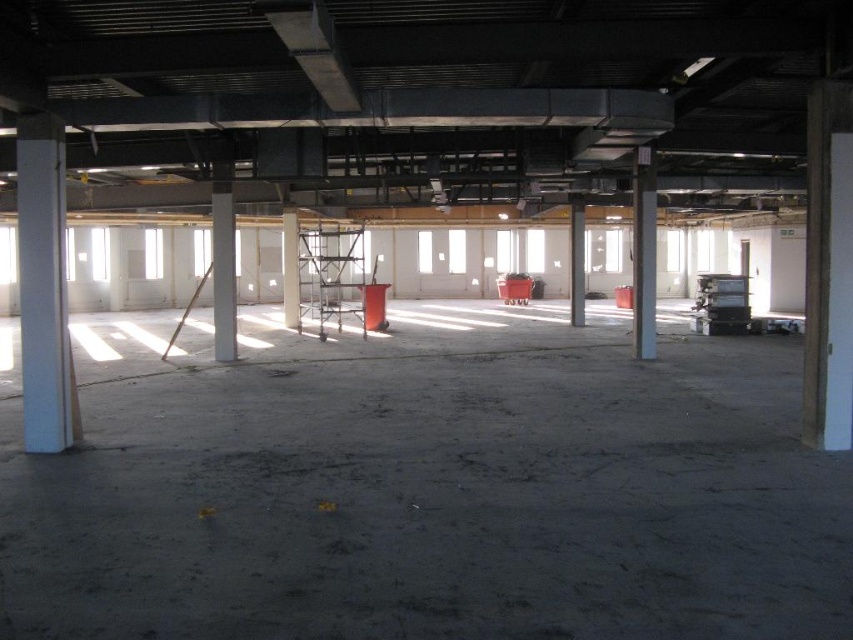
Consider the image. You are standing at point (425, 484) in the warehouse. What is the surface you are standing on?

The surface at point (425, 484) is the concrete floor at center.

You are standing in the center of the room. Which direction should you move to reach the white concrete pillar at left?

The white concrete pillar at left is located at point (44, 285), so you should move towards the left side of the room to reach it.